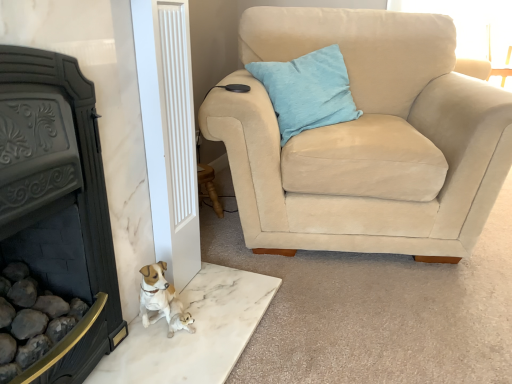
Question: From the image's perspective, is beige suede armchair at upper right positioned above or below light blue fabric pillow at upper right?

Choices:
 (A) above
 (B) below

Answer: (B)

Question: Relative to light blue fabric pillow at upper right, is beige suede armchair at upper right in front or behind?

Choices:
 (A) behind
 (B) front

Answer: (B)

Question: Considering the real-world distances, which object is farthest from the beige suede armchair at upper right?

Choices:
 (A) light blue fabric pillow at upper right
 (B) black cast iron fireplace at left

Answer: (B)

Question: Based on their relative distances, which object is farther from the light blue fabric pillow at upper right?

Choices:
 (A) beige suede armchair at upper right
 (B) black cast iron fireplace at left

Answer: (B)